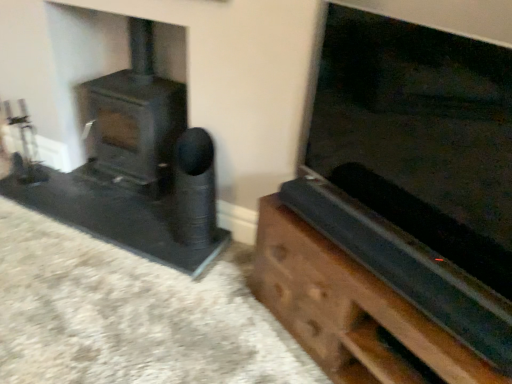
You are a GUI agent. You are given a task and a screenshot of the screen. Output one action in this format:
    pyautogui.click(x=<x>, y=<y>)
    Task: Click on the free region on the left part of black matte speaker at center
    This screenshot has width=512, height=384.
    Given the screenshot: What is the action you would take?
    pyautogui.click(x=151, y=235)